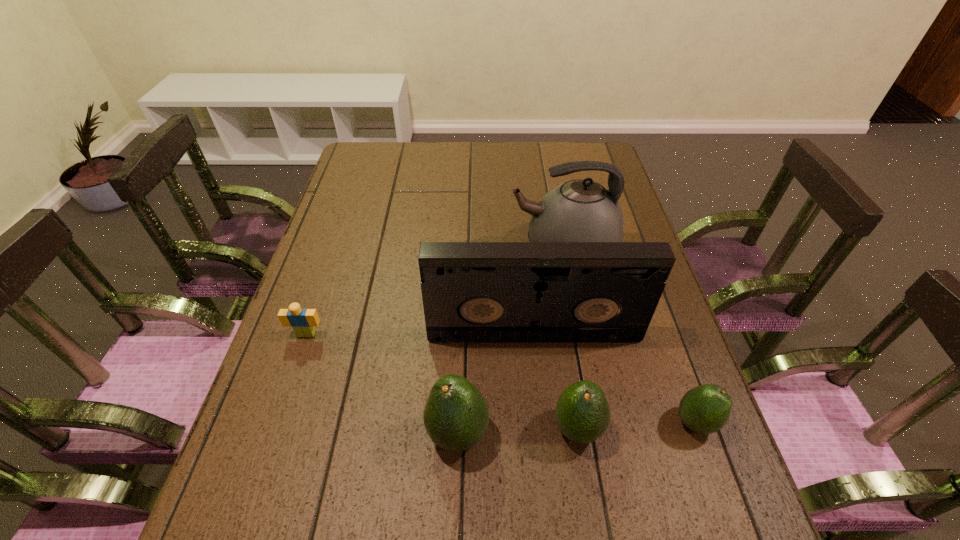
Locate an element on the screen. vacant spot to place a avocado on the left is located at coordinates (336, 440).